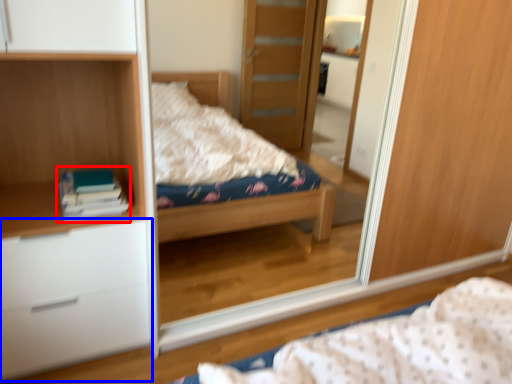
Question: Which object is closer to the camera taking this photo, book (highlighted by a red box) or chest of drawers (highlighted by a blue box)?

Choices:
 (A) book
 (B) chest of drawers

Answer: (B)